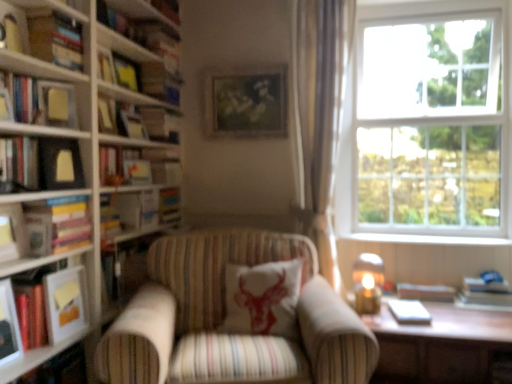
Locate an element on the screen. This screenshot has width=512, height=384. vacant space situated above wooden table at lower right (from a real-world perspective) is located at coordinates (417, 320).